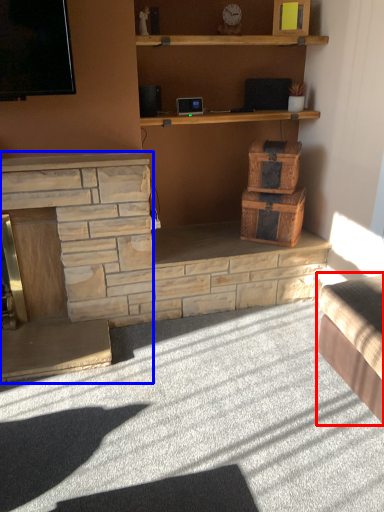
Question: Among these objects, which one is farthest to the camera, studio couch (highlighted by a red box) or fireplace (highlighted by a blue box)?

Choices:
 (A) studio couch
 (B) fireplace

Answer: (B)